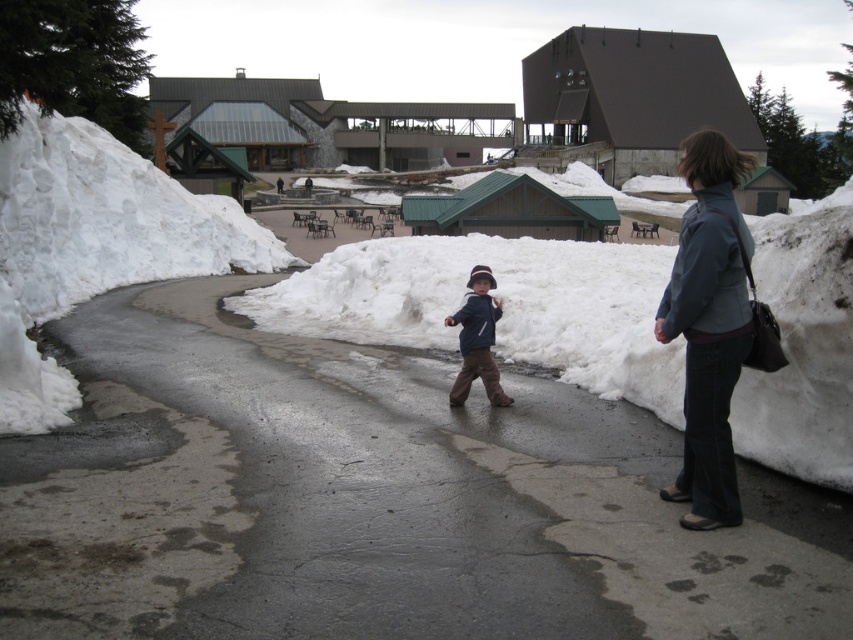
Question: In this image, where is white fluffy snow at center located relative to brushed blue jacket at center?

Choices:
 (A) above
 (B) below

Answer: (A)

Question: Which object appears closest to the camera in this image?

Choices:
 (A) gray matte jacket at right
 (B) white fluffy snow at center
 (C) denim jacket at right

Answer: (A)

Question: Where is denim jacket at right located in relation to gray matte jacket at right in the image?

Choices:
 (A) left
 (B) right

Answer: (B)

Question: Does smooth asphalt road at center have a smaller size compared to white fluffy snow at center?

Choices:
 (A) yes
 (B) no

Answer: (A)

Question: Considering the real-world distances, which object is closest to the gray matte jacket at right?

Choices:
 (A) matte blue jacket at center
 (B) denim jacket at right
 (C) white fluffy snow at center
 (D) smooth asphalt road at center

Answer: (B)

Question: Which object appears closest to the camera in this image?

Choices:
 (A) gray matte jacket at right
 (B) brushed blue jacket at center
 (C) smooth asphalt road at center
 (D) matte blue jacket at center

Answer: (C)